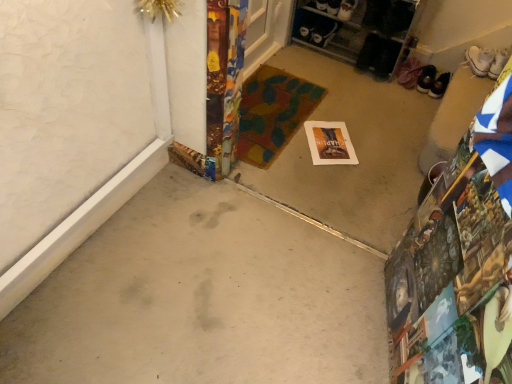
Question: Is multicolored fabric doormat at center located outside white canvas sneakers at upper right, arranged as the 3th footwear when viewed from the left?

Choices:
 (A) no
 (B) yes

Answer: (B)

Question: Does multicolored fabric doormat at center lie behind white canvas sneakers at upper right, which is the first footwear in right-to-left order?

Choices:
 (A) yes
 (B) no

Answer: (B)

Question: Can you confirm if multicolored fabric doormat at center is positioned to the right of white canvas sneakers at upper right, arranged as the 3th footwear when viewed from the left?

Choices:
 (A) no
 (B) yes

Answer: (A)

Question: Is multicolored fabric doormat at center positioned in front of white canvas sneakers at upper right, arranged as the 3th footwear when viewed from the left?

Choices:
 (A) no
 (B) yes

Answer: (B)

Question: From the image's perspective, does multicolored fabric doormat at center appear higher than white canvas sneakers at upper right, arranged as the 3th footwear when viewed from the left?

Choices:
 (A) no
 (B) yes

Answer: (A)

Question: Is matte paper postcard at center wider or thinner than white canvas sneakers at upper right, arranged as the 3th footwear when viewed from the left?

Choices:
 (A) thin
 (B) wide

Answer: (B)

Question: From the image's perspective, is matte paper postcard at center above or below white canvas sneakers at upper right, which is the first footwear in right-to-left order?

Choices:
 (A) below
 (B) above

Answer: (A)

Question: Relative to white canvas sneakers at upper right, arranged as the 3th footwear when viewed from the left, is matte paper postcard at center in front or behind?

Choices:
 (A) behind
 (B) front

Answer: (B)

Question: From a real-world perspective, is matte paper postcard at center positioned above or below white canvas sneakers at upper right, arranged as the 3th footwear when viewed from the left?

Choices:
 (A) above
 (B) below

Answer: (B)

Question: Is gray concrete at center, the second concrete from the back, taller or shorter than matte paper postcard at center?

Choices:
 (A) tall
 (B) short

Answer: (A)

Question: Does point click(284, 233) appear closer or farther from the camera than point click(311, 145)?

Choices:
 (A) closer
 (B) farther

Answer: (A)

Question: From the image's perspective, is gray concrete at center, marked as the 1th concrete in a front-to-back arrangement, located above or below matte paper postcard at center?

Choices:
 (A) above
 (B) below

Answer: (B)

Question: Is gray concrete at center, the second concrete from the back, spatially inside matte paper postcard at center, or outside of it?

Choices:
 (A) outside
 (B) inside

Answer: (A)

Question: From a real-world perspective, is black leather shoes at upper right, positioned as the second footwear in left-to-right order, above or below matte paper postcard at center?

Choices:
 (A) above
 (B) below

Answer: (A)

Question: Would you say black leather shoes at upper right, which ranks as the 2th footwear in right-to-left order, is inside or outside matte paper postcard at center?

Choices:
 (A) outside
 (B) inside

Answer: (A)